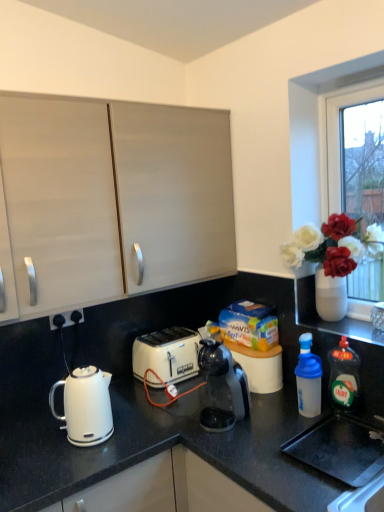
Question: Is white glossy electric kettle at lower left thinner than matte white cabinet at upper left?

Choices:
 (A) no
 (B) yes

Answer: (A)

Question: Is white glossy electric kettle at lower left at the left side of matte white cabinet at upper left?

Choices:
 (A) no
 (B) yes

Answer: (A)

Question: Is matte white cabinet at upper left inside white glossy electric kettle at lower left?

Choices:
 (A) yes
 (B) no

Answer: (B)

Question: Is white glossy electric kettle at lower left bigger than matte white cabinet at upper left?

Choices:
 (A) no
 (B) yes

Answer: (B)

Question: Does white glossy electric kettle at lower left have a greater height compared to matte white cabinet at upper left?

Choices:
 (A) yes
 (B) no

Answer: (A)

Question: Looking at the image, does matte white cabinet at upper left seem bigger or smaller compared to white glossy electric kettle at lower left?

Choices:
 (A) big
 (B) small

Answer: (B)

Question: Would you say matte white cabinet at upper left is to the left or to the right of white glossy electric kettle at lower left in the picture?

Choices:
 (A) right
 (B) left

Answer: (B)

Question: From a real-world perspective, is matte white cabinet at upper left positioned above or below white glossy electric kettle at lower left?

Choices:
 (A) above
 (B) below

Answer: (A)

Question: Is matte white cabinet at upper left wider or thinner than white glossy electric kettle at lower left?

Choices:
 (A) thin
 (B) wide

Answer: (A)

Question: From the image's perspective, is green translucent bottle at right, acting as the 2th bottle starting from the left, above or below white glossy electric kettle at lower left?

Choices:
 (A) above
 (B) below

Answer: (A)

Question: Based on their sizes in the image, would you say green translucent bottle at right, acting as the 1th bottle starting from the right, is bigger or smaller than white glossy electric kettle at lower left?

Choices:
 (A) big
 (B) small

Answer: (B)

Question: Is green translucent bottle at right, acting as the 1th bottle starting from the right, in front of or behind white glossy electric kettle at lower left in the image?

Choices:
 (A) front
 (B) behind

Answer: (B)

Question: Is point (349, 369) positioned closer to the camera than point (329, 349)?

Choices:
 (A) closer
 (B) farther

Answer: (A)

Question: Does point (49, 316) appear closer or farther from the camera than point (301, 395)?

Choices:
 (A) closer
 (B) farther

Answer: (A)

Question: Is black plastic electrical outlet at lower left taller or shorter than transparent plastic bottle at right, the second bottle positioned from the right?

Choices:
 (A) short
 (B) tall

Answer: (A)